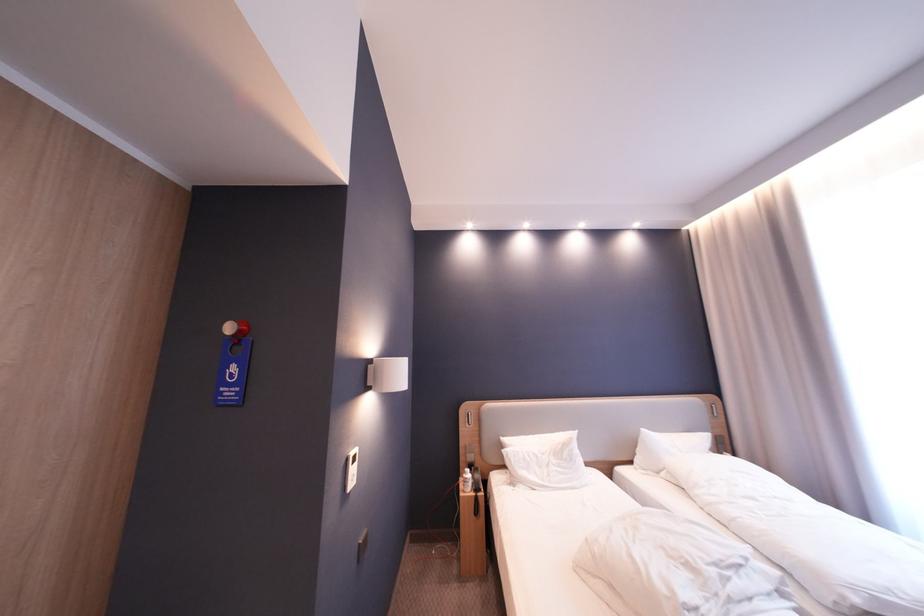
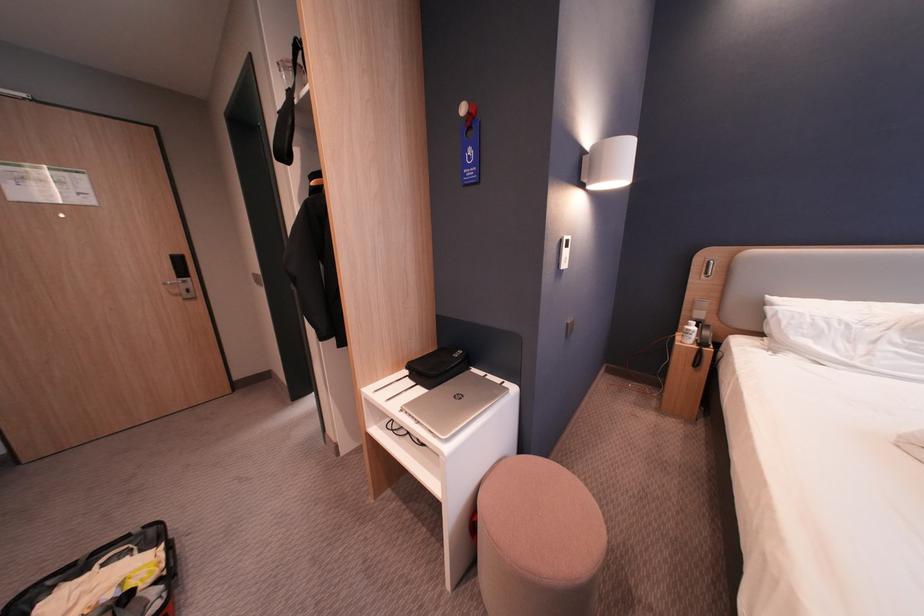
The point at (476, 477) is marked in the first image. Where is the corresponding point in the second image?

(698, 328)